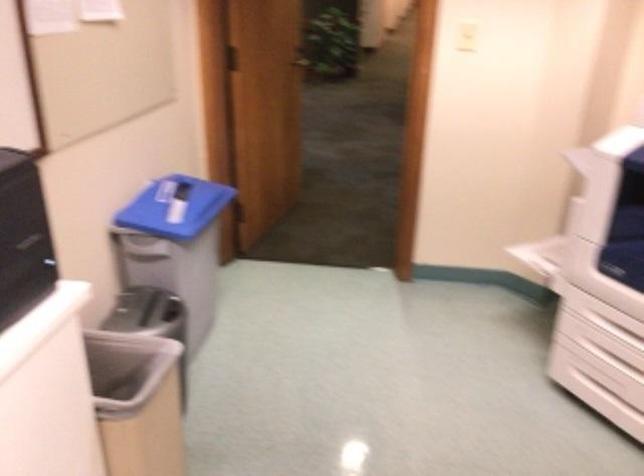
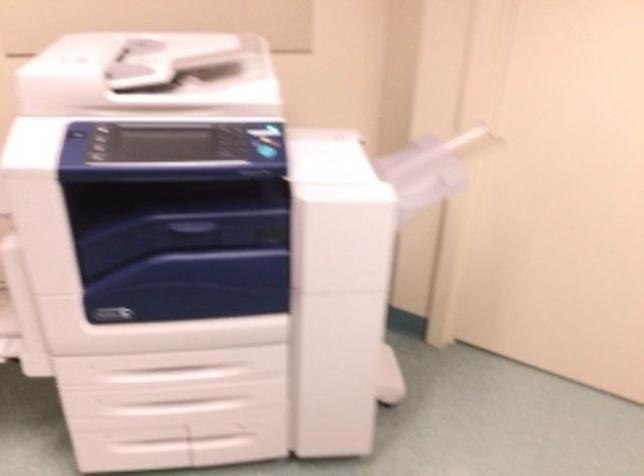
The first image is from the beginning of the video and the second image is from the end. How did the camera likely rotate when shooting the video?

The rotation direction of the camera is right-down.